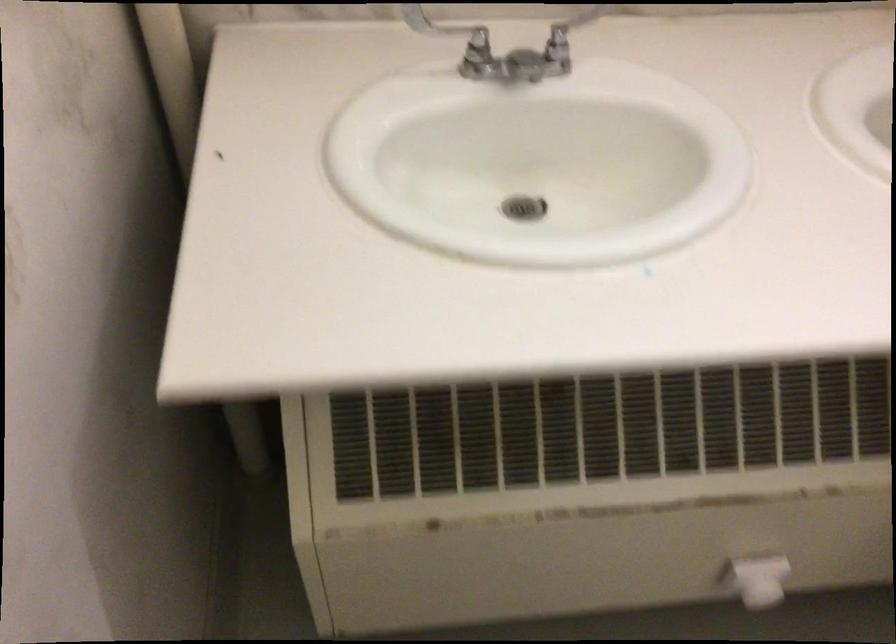
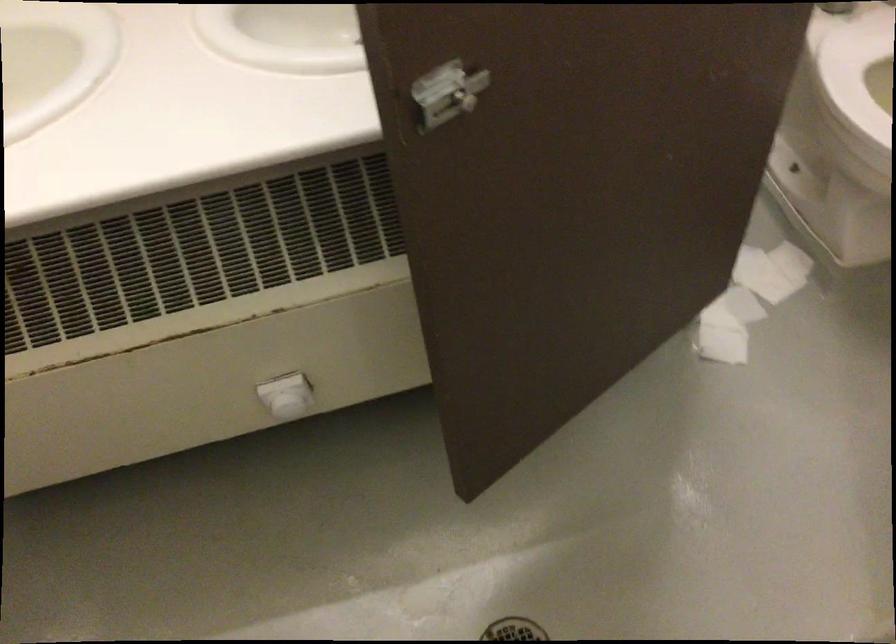
Question: What movement of the cameraman would produce the second image?

Choices:
 (A) Left
 (B) Right
 (C) Forward
 (D) Backward

Answer: (B)